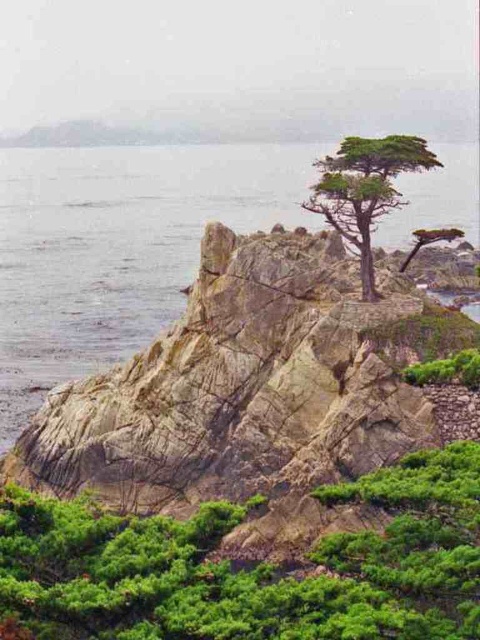
Question: Does clear water at center appear on the right side of green textured tree at center?

Choices:
 (A) no
 (B) yes

Answer: (A)

Question: Is clear water at center bigger than green textured tree at center?

Choices:
 (A) no
 (B) yes

Answer: (B)

Question: Is clear water at center closer to the viewer compared to green textured tree at center?

Choices:
 (A) yes
 (B) no

Answer: (B)

Question: Which object is closer to the camera taking this photo?

Choices:
 (A) green textured tree at center
 (B) clear water at center

Answer: (A)